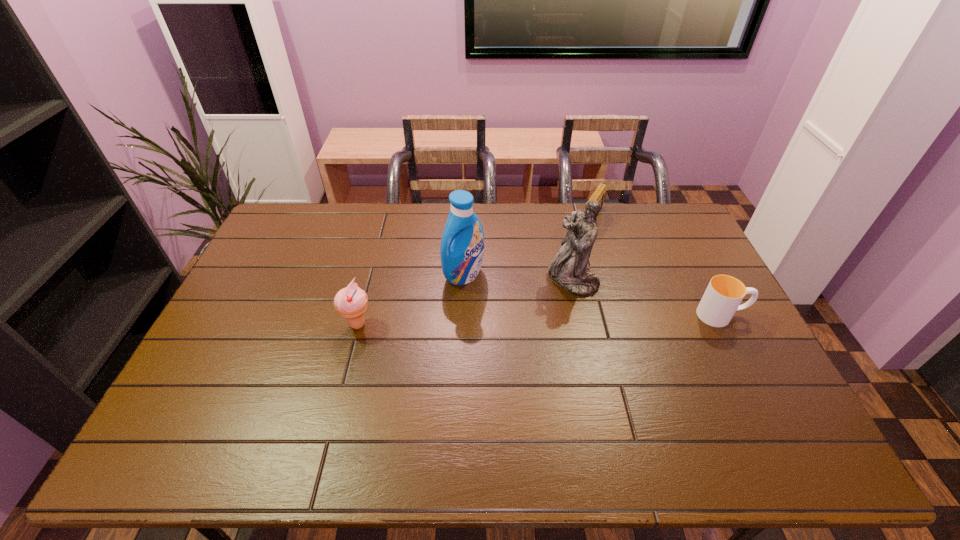
Identify the location of free region at the left edge of the desktop. (253, 282).

The image size is (960, 540). In the image, there is a desktop. Find the location of `vacant space at the right edge`. vacant space at the right edge is located at coordinates (676, 283).

Find the location of `vacant area at the far left corner`. vacant area at the far left corner is located at coordinates (320, 217).

Locate an element on the screen. The width and height of the screenshot is (960, 540). vacant region at the far right corner of the desktop is located at coordinates (643, 212).

Locate an element on the screen. The height and width of the screenshot is (540, 960). free space between the cup and the figurine is located at coordinates (647, 298).

Where is `empty space between the detergent and the icecream`? This screenshot has height=540, width=960. empty space between the detergent and the icecream is located at coordinates (411, 300).

What are the coordinates of `blank region between the figurine and the third shortest object` in the screenshot? It's located at (466, 302).

Locate an element on the screen. This screenshot has width=960, height=540. empty location between the cup and the detergent is located at coordinates (592, 295).

I want to click on vacant point located between the detergent and the figurine, so click(x=518, y=277).

What are the coordinates of `free point between the pistol and the detergent` in the screenshot? It's located at (528, 246).